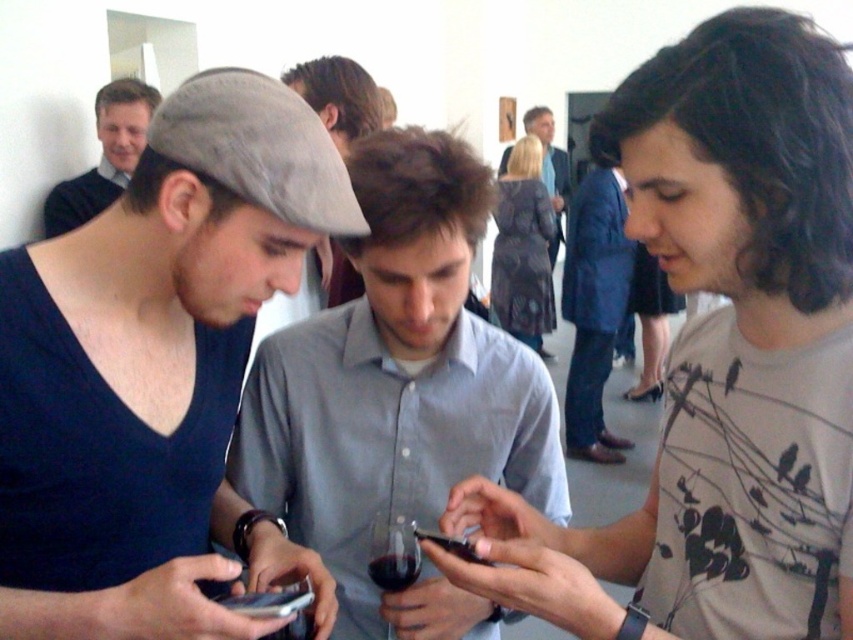
Is gray matte shirt at center closer to the viewer compared to black glossy smartphone at center?

Yes, it is.

Between gray matte shirt at center and black glossy smartphone at center, which one appears on the left side from the viewer's perspective?

From the viewer's perspective, black glossy smartphone at center appears more on the left side.

Does point (659, 109) come in front of point (413, 531)?

Yes.

Where is `gray matte shirt at center`? This screenshot has width=853, height=640. gray matte shirt at center is located at coordinates (718, 356).

Which is more to the left, matte gray cap at center or black glossy smartphone at center?

From the viewer's perspective, matte gray cap at center appears more on the left side.

Is matte gray cap at center smaller than black glossy smartphone at center?

Incorrect, matte gray cap at center is not smaller in size than black glossy smartphone at center.

Find the location of a particular element. The image size is (853, 640). matte gray cap at center is located at coordinates (152, 362).

Who is taller, light gray shirt at center or matte black sweater at upper left?

light gray shirt at center is taller.

Can you confirm if light gray shirt at center is positioned to the left of matte black sweater at upper left?

Incorrect, light gray shirt at center is not on the left side of matte black sweater at upper left.

Locate an element on the screen. The width and height of the screenshot is (853, 640). light gray shirt at center is located at coordinates (398, 394).

Where is `light gray shirt at center`? The height and width of the screenshot is (640, 853). light gray shirt at center is located at coordinates pos(398,394).